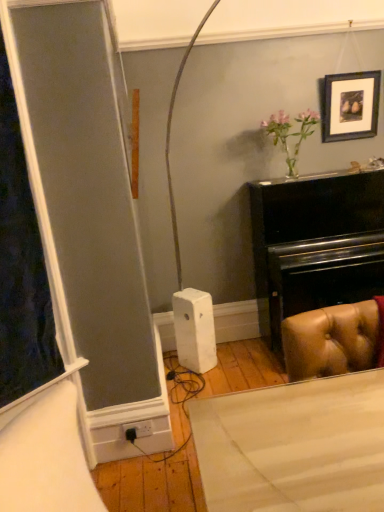
Question: From the image's perspective, relative to black plastic plug at lower center, is wooden picture frame at upper right above or below?

Choices:
 (A) below
 (B) above

Answer: (B)

Question: Would you say wooden picture frame at upper right is to the left or to the right of black plastic plug at lower center in the picture?

Choices:
 (A) right
 (B) left

Answer: (A)

Question: Considering the positions of wooden picture frame at upper right and black plastic plug at lower center in the image, is wooden picture frame at upper right bigger or smaller than black plastic plug at lower center?

Choices:
 (A) small
 (B) big

Answer: (B)

Question: From a real-world perspective, relative to wooden picture frame at upper right, is black plastic plug at lower center vertically above or below?

Choices:
 (A) below
 (B) above

Answer: (A)

Question: Looking at the image, does black plastic plug at lower center seem bigger or smaller compared to wooden picture frame at upper right?

Choices:
 (A) big
 (B) small

Answer: (B)

Question: Choose the correct answer: Is black plastic plug at lower center inside wooden picture frame at upper right or outside it?

Choices:
 (A) inside
 (B) outside

Answer: (B)

Question: Considering the positions of black plastic plug at lower center and wooden picture frame at upper right in the image, is black plastic plug at lower center taller or shorter than wooden picture frame at upper right?

Choices:
 (A) tall
 (B) short

Answer: (B)